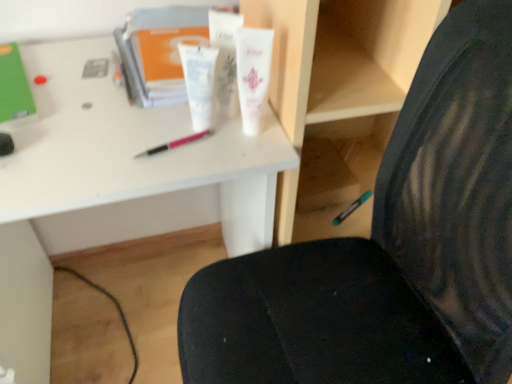
Find the location of a particular element. vacant space behind pink plastic pen at center is located at coordinates (160, 105).